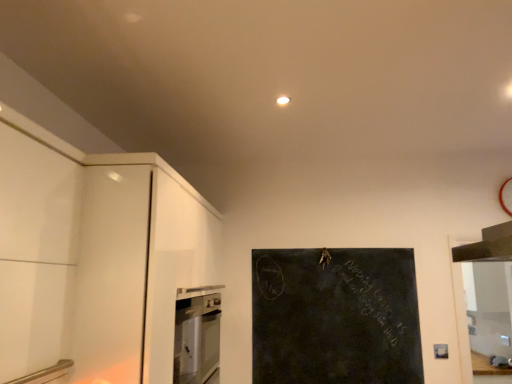
Question: Considering their positions, is black chalkboard at center located in front of or behind satin stainless steel dishwasher at lower left?

Choices:
 (A) behind
 (B) front

Answer: (A)

Question: From a real-world perspective, is black chalkboard at center above or below satin stainless steel dishwasher at lower left?

Choices:
 (A) below
 (B) above

Answer: (B)

Question: Considering the relative positions of black chalkboard at center and satin stainless steel dishwasher at lower left in the image provided, is black chalkboard at center to the left or to the right of satin stainless steel dishwasher at lower left?

Choices:
 (A) right
 (B) left

Answer: (A)

Question: In terms of height, does satin stainless steel dishwasher at lower left look taller or shorter compared to black chalkboard at center?

Choices:
 (A) tall
 (B) short

Answer: (B)

Question: Looking at the image, does satin stainless steel dishwasher at lower left seem bigger or smaller compared to black chalkboard at center?

Choices:
 (A) small
 (B) big

Answer: (B)

Question: From a real-world perspective, is satin stainless steel dishwasher at lower left above or below black chalkboard at center?

Choices:
 (A) above
 (B) below

Answer: (B)

Question: Considering the positions of satin stainless steel dishwasher at lower left and black chalkboard at center in the image, is satin stainless steel dishwasher at lower left wider or thinner than black chalkboard at center?

Choices:
 (A) thin
 (B) wide

Answer: (B)